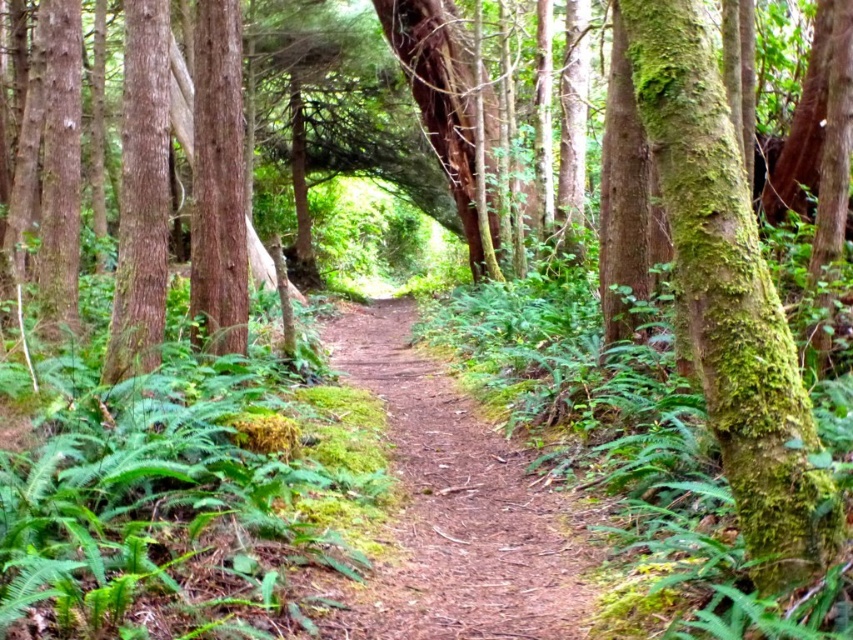
Can you confirm if green mossy bark tree at right is taller than brown dirt path at center?

Yes, green mossy bark tree at right is taller than brown dirt path at center.

Is point (740, 474) positioned behind point (334, 323)?

No, it is in front of (334, 323).

Image resolution: width=853 pixels, height=640 pixels. In order to click on green mossy bark tree at right in this screenshot , I will do `click(730, 300)`.